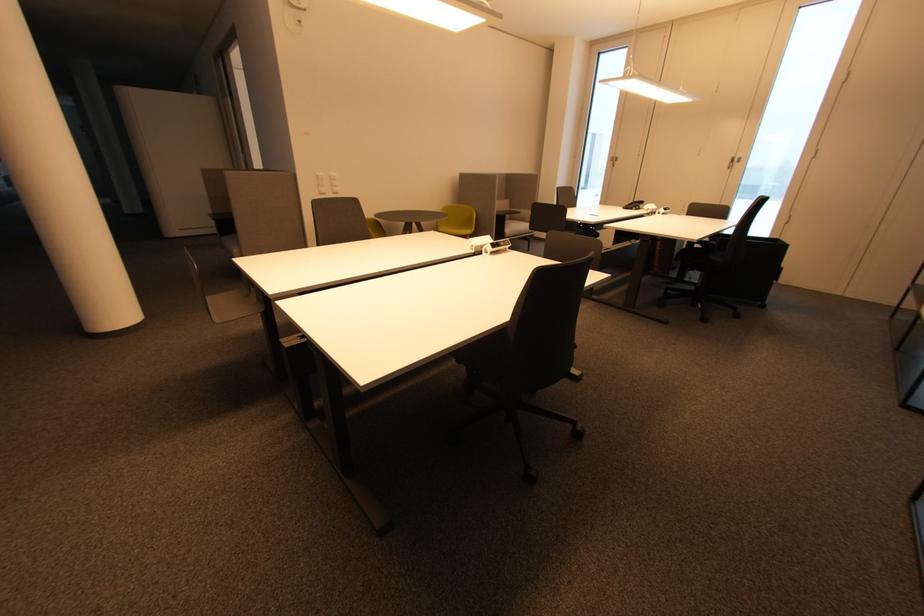
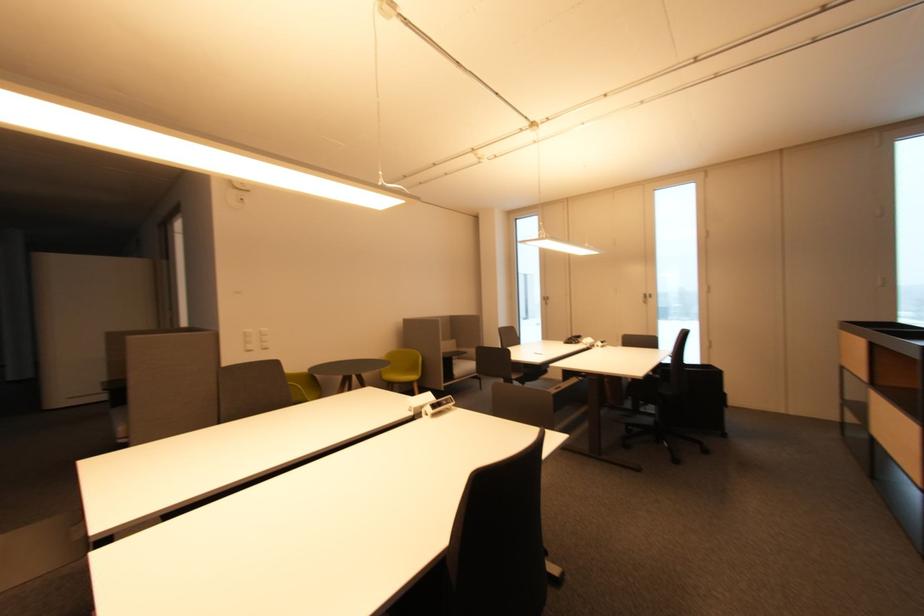
Question: The images are taken continuously from a first-person perspective. In which direction is your viewpoint rotating?

Choices:
 (A) Left
 (B) Right
 (C) Up
 (D) Down

Answer: (C)